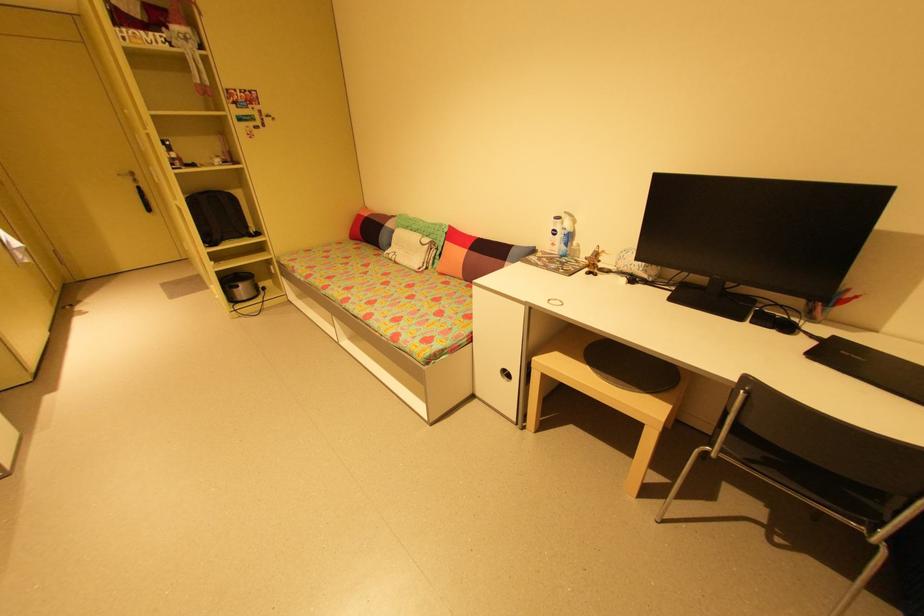
Find where to sit the black chair sitting surface. Please return your answer as a coordinate pair (x, y).

(819, 466)